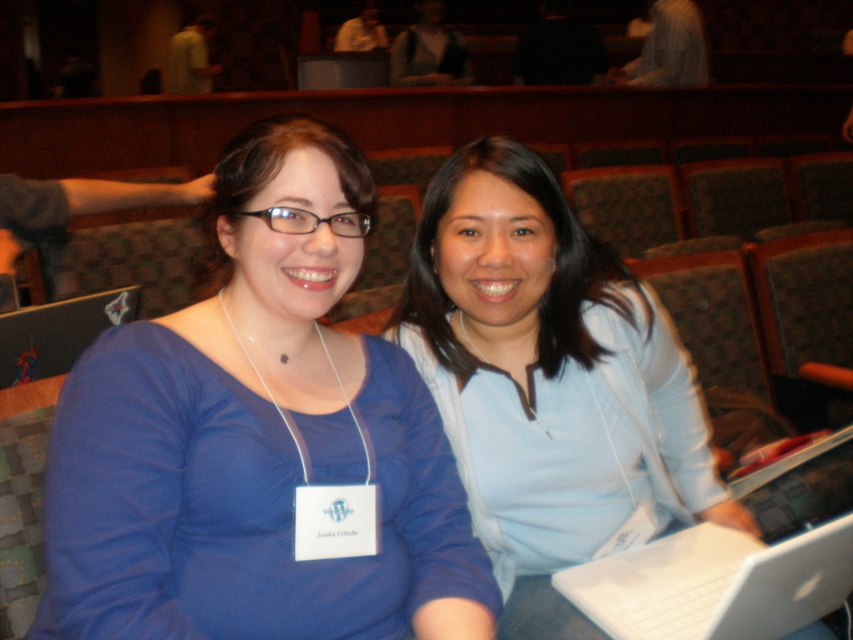
Between matte blue shirt at center and white plastic laptop at center, which one appears on the left side from the viewer's perspective?

From the viewer's perspective, matte blue shirt at center appears more on the left side.

Where is `matte blue shirt at center`? The height and width of the screenshot is (640, 853). matte blue shirt at center is located at coordinates (257, 438).

Does point (573, 461) come closer to viewer compared to point (801, 573)?

No, it is behind (801, 573).

Does light blue fabric shirt at center appear over white plastic laptop at center?

Correct, light blue fabric shirt at center is located above white plastic laptop at center.

Between point (491, 518) and point (564, 584), which one is positioned behind?

The point (491, 518) is more distant.

Identify the location of light blue fabric shirt at center. [549, 380].

In the scene shown: Which is more to the left, matte blue shirt at center or light blue fabric shirt at center?

matte blue shirt at center

Can you confirm if matte blue shirt at center is smaller than light blue fabric shirt at center?

Correct, matte blue shirt at center occupies less space than light blue fabric shirt at center.

Where is `matte blue shirt at center`? The width and height of the screenshot is (853, 640). matte blue shirt at center is located at coordinates (257, 438).